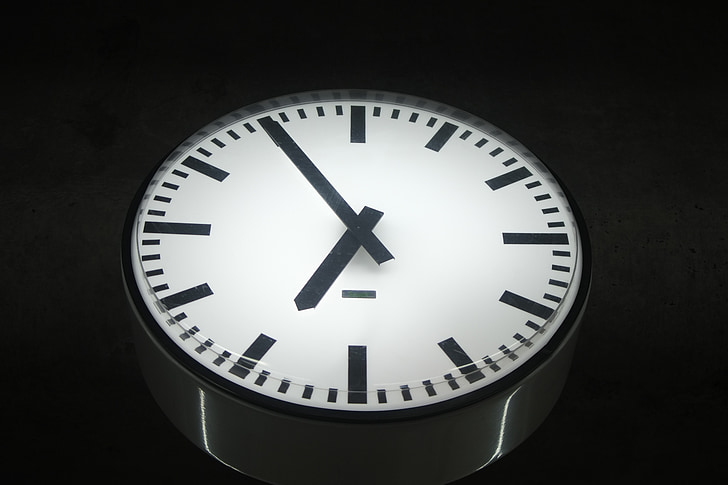
Where is `clock hour markers`? This screenshot has width=728, height=485. clock hour markers is located at coordinates (356, 364), (258, 348), (185, 292), (451, 343), (430, 145), (359, 131).